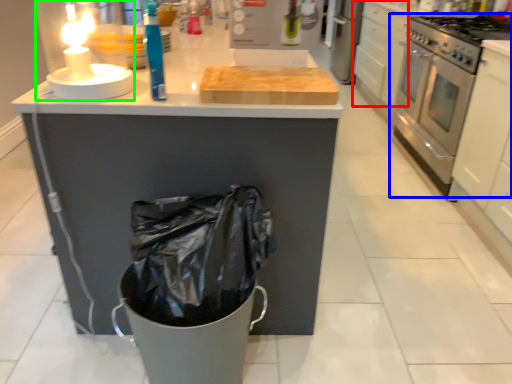
Question: Which object is the farthest from drawer (highlighted by a red box)? Choose among these: kitchen appliance (highlighted by a blue box) or candle holder (highlighted by a green box).

Choices:
 (A) kitchen appliance
 (B) candle holder

Answer: (B)